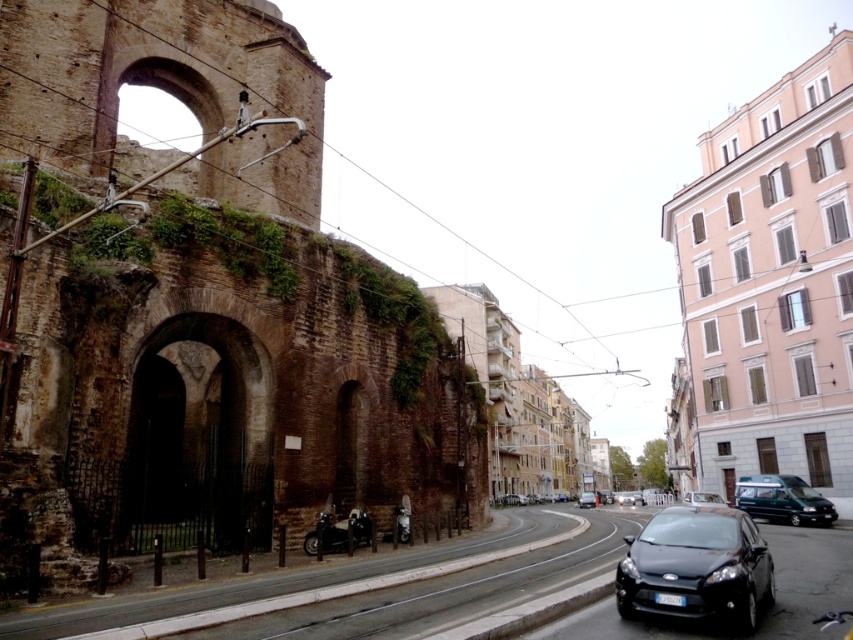
You are a delivery person needing to park your vehicle. You see a green matte van at center and a shiny chrome motorcycle at center. Which vehicle is positioned lower in the image?

The green matte van at center is located below the shiny chrome motorcycle at center, so it is positioned lower in the image.

You are a delivery driver needing to park your vehicle between the green matte van at center and the shiny chrome motorcycle at center. Which side should you park on to ensure you are between them?

You should park to the right of the shiny chrome motorcycle at center because the green matte van at center is already positioned to the right of the shiny chrome motorcycle at center, placing you between them.

You are a delivery driver who needs to park your vehicle between the shiny black car at lower right and the white glossy van at center. Your van is 2 meters wide. Can you fit your van between them?

The shiny black car at lower right is thinner than the white glossy van at center, but the description does not provide exact measurements. Therefore, it is uncertain if your van can fit between them without knowing the exact widths of the vehicles.